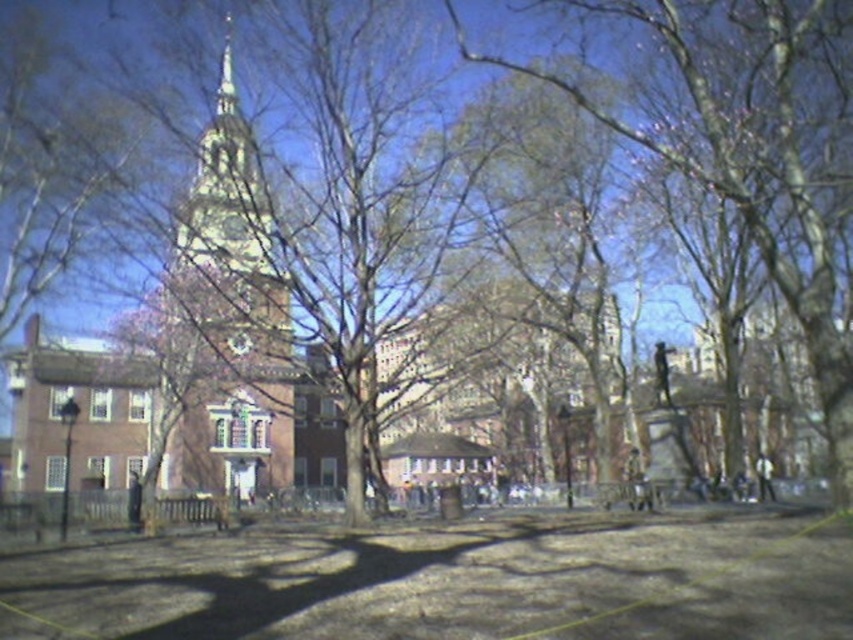
Question: Can you confirm if brown brick tower at center is positioned below shiny silver spire at upper center?

Choices:
 (A) no
 (B) yes

Answer: (B)

Question: Does brown brick tower at center appear on the right side of shiny silver spire at upper center?

Choices:
 (A) no
 (B) yes

Answer: (A)

Question: Does brown brick tower at center appear over shiny silver spire at upper center?

Choices:
 (A) no
 (B) yes

Answer: (A)